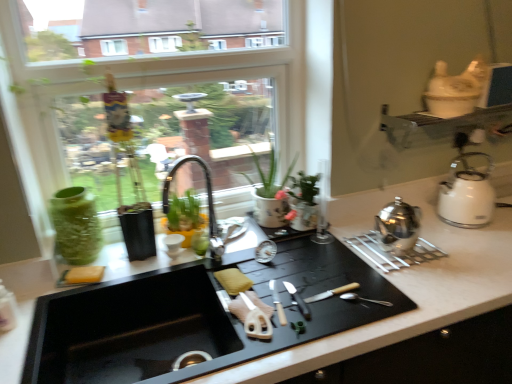
Image resolution: width=512 pixels, height=384 pixels. Identify the location of vacant space behind silver metallic knife at center, which appears as the 1th knife when viewed from the left. 286,266.